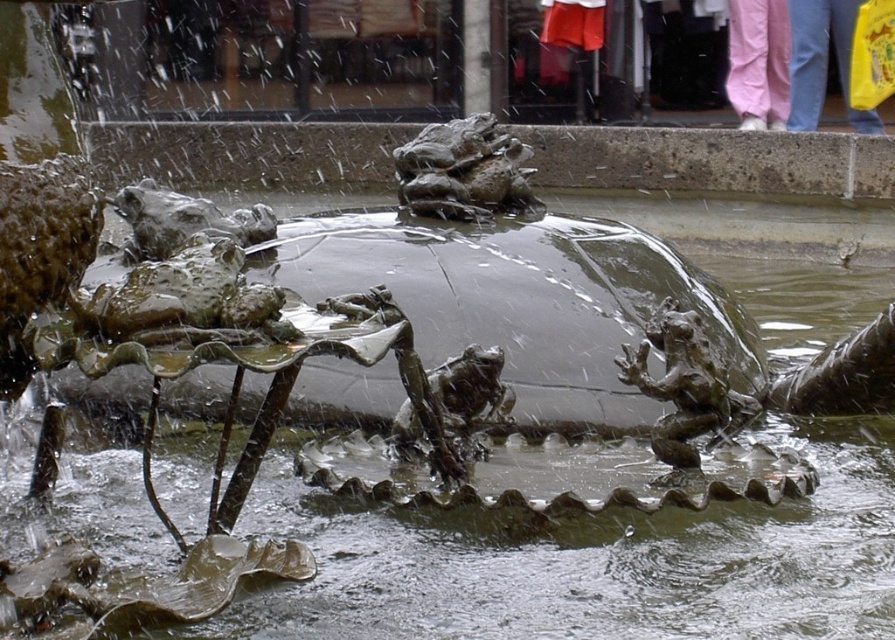
Question: Which of the following is the farthest from the observer?

Choices:
 (A) coord(670,433)
 (B) coord(470,205)

Answer: (B)

Question: Among these objects, which one is nearest to the camera?

Choices:
 (A) bronze textured frog at center
 (B) bronze textured frog at upper center

Answer: (A)

Question: Can you confirm if bronze textured frog at center is positioned to the right of bronze textured frog at upper center?

Choices:
 (A) yes
 (B) no

Answer: (A)

Question: Is bronze textured frog at center below bronze textured frog at upper center?

Choices:
 (A) yes
 (B) no

Answer: (A)

Question: Which point is closer to the camera taking this photo?

Choices:
 (A) (683, 320)
 (B) (413, 211)

Answer: (A)

Question: From the image, what is the correct spatial relationship of bronze textured frog at center in relation to bronze textured frog at upper center?

Choices:
 (A) left
 (B) right

Answer: (B)